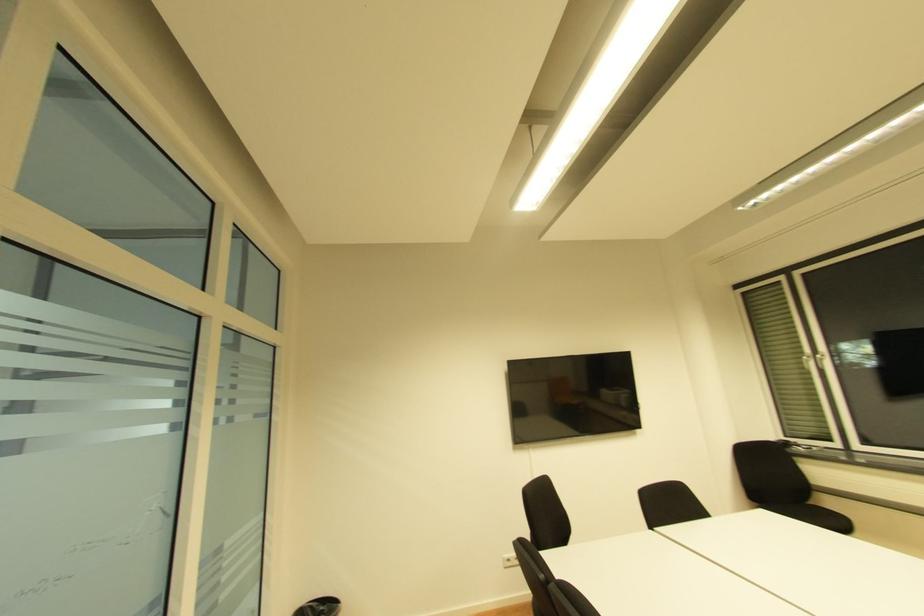
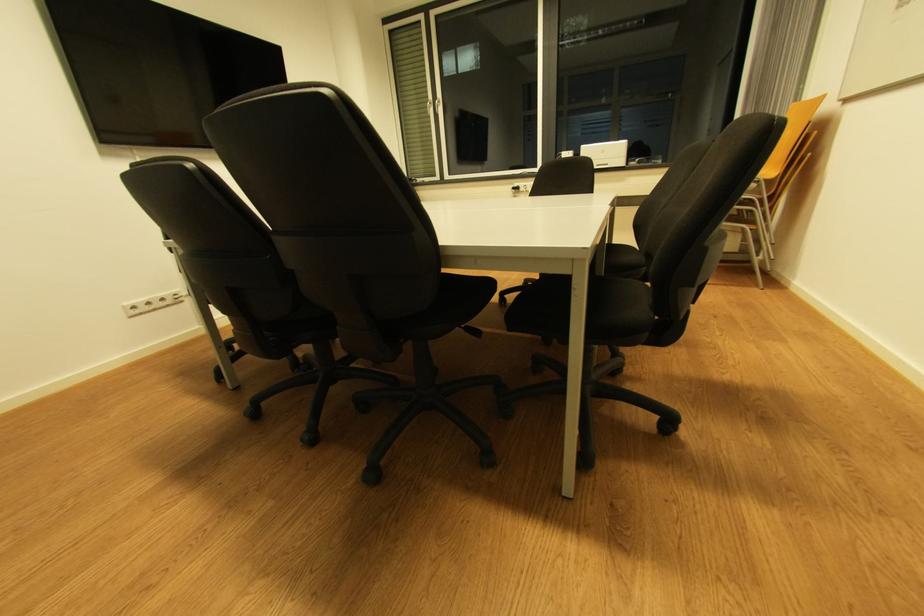
How did the camera likely rotate?

The camera rotated toward right-down.